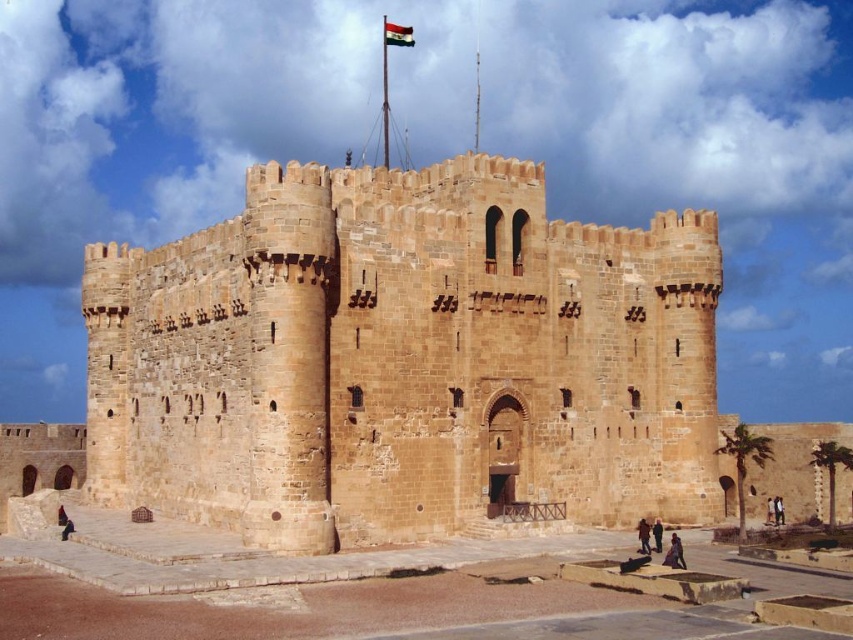
Is point (173, 253) in front of point (396, 44)?

Yes, point (173, 253) is in front of point (396, 44).

Between brown stone fort at center and polyester flag at upper center, which one appears on the left side from the viewer's perspective?

Positioned to the left is polyester flag at upper center.

Identify the location of brown stone fort at center. Image resolution: width=853 pixels, height=640 pixels. (404, 360).

Locate an element on the screen. Image resolution: width=853 pixels, height=640 pixels. brown stone fort at center is located at coordinates coord(404,360).